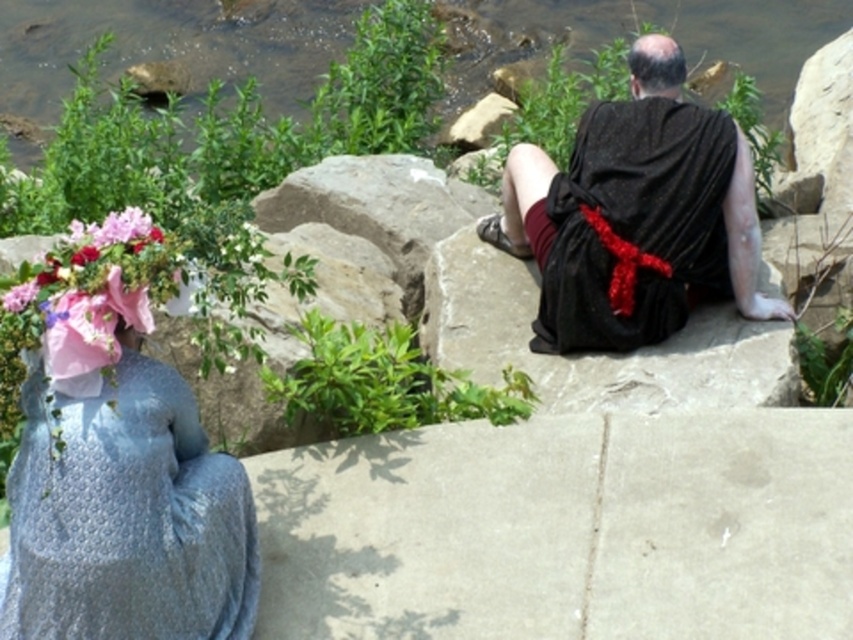
Question: Does pink fabric bouquet at left come behind bald head at upper center?

Choices:
 (A) no
 (B) yes

Answer: (A)

Question: Which point is farther from the camera taking this photo?

Choices:
 (A) (144, 262)
 (B) (648, 35)
 (C) (656, 280)
 (D) (134, 332)

Answer: (B)

Question: Is shiny blue dress at lower left above bald head at upper center?

Choices:
 (A) no
 (B) yes

Answer: (A)

Question: Is shiny blue dress at lower left above bald head at upper center?

Choices:
 (A) yes
 (B) no

Answer: (B)

Question: Which object is positioned closest to the black satin robe at upper right?

Choices:
 (A) bald head at upper center
 (B) shiny blue dress at lower left
 (C) pink fabric bouquet at left

Answer: (A)

Question: Which object is positioned closest to the black satin robe at upper right?

Choices:
 (A) pink fabric bouquet at left
 (B) shiny blue dress at lower left
 (C) bald head at upper center

Answer: (C)